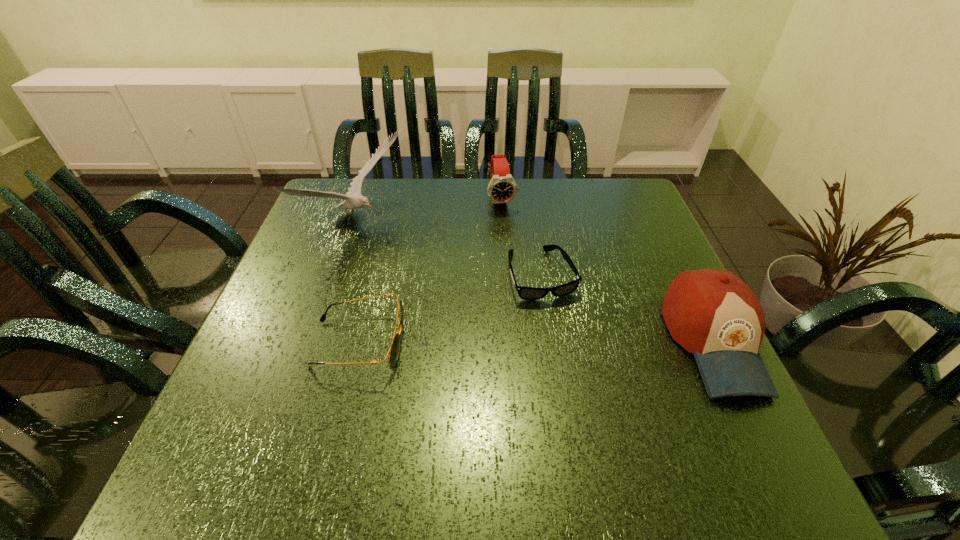
The image size is (960, 540). Identify the location of sunglasses that is positioned at the left edge. click(x=394, y=350).

You are a GUI agent. You are given a task and a screenshot of the screen. Output one action in this format:
    pyautogui.click(x=<x>, y=<y>)
    Task: Click on the gull that is positioned at the left edge
    Image resolution: width=960 pixels, height=540 pixels.
    Given the screenshot: What is the action you would take?
    pyautogui.click(x=353, y=198)

Where is `object at the right edge`? The width and height of the screenshot is (960, 540). object at the right edge is located at coordinates (713, 314).

Locate an element on the screen. This screenshot has width=960, height=540. object positioned at the far left corner is located at coordinates point(353,198).

Where is `object that is positioned at the near right corner`? Image resolution: width=960 pixels, height=540 pixels. object that is positioned at the near right corner is located at coordinates 713,314.

The width and height of the screenshot is (960, 540). In the image, there is a desktop. In order to click on vacant space at the far edge in this screenshot , I will do `click(432, 207)`.

Locate an element on the screen. vacant space at the near edge of the desktop is located at coordinates (356, 407).

In order to click on free space at the left edge of the desktop in this screenshot , I will do `click(315, 231)`.

Where is `vacant region at the right edge of the desktop`? The image size is (960, 540). vacant region at the right edge of the desktop is located at coordinates (655, 248).

You are a GUI agent. You are given a task and a screenshot of the screen. Output one action in this format:
    pyautogui.click(x=<x>, y=<y>)
    Task: Click on the vacant space at the far left corner of the desktop
    
    Given the screenshot: What is the action you would take?
    pyautogui.click(x=327, y=202)